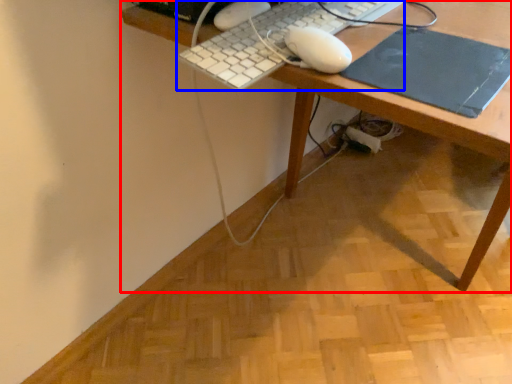
Question: Which object is further to the camera taking this photo, desk (highlighted by a red box) or computer keyboard (highlighted by a blue box)?

Choices:
 (A) desk
 (B) computer keyboard

Answer: (B)